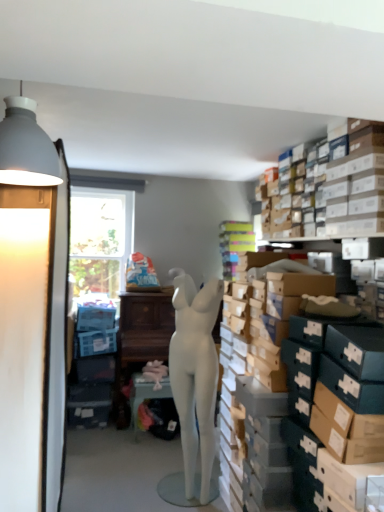
Question: Is white matte lampshade at upper left shorter than matte white lampshade at left?

Choices:
 (A) yes
 (B) no

Answer: (A)

Question: Can you confirm if white matte lampshade at upper left is positioned to the left of matte white lampshade at left?

Choices:
 (A) yes
 (B) no

Answer: (B)

Question: Could you tell me if white matte lampshade at upper left is turned towards matte white lampshade at left?

Choices:
 (A) no
 (B) yes

Answer: (B)

Question: Would you say white matte lampshade at upper left is outside matte white lampshade at left?

Choices:
 (A) no
 (B) yes

Answer: (B)

Question: Is the position of white matte lampshade at upper left more distant than that of matte white lampshade at left?

Choices:
 (A) no
 (B) yes

Answer: (A)

Question: Does white matte lampshade at upper left have a larger size compared to matte white lampshade at left?

Choices:
 (A) no
 (B) yes

Answer: (A)

Question: Can you confirm if matte white table at center is smaller than white matte mannequin at center?

Choices:
 (A) yes
 (B) no

Answer: (A)

Question: Does matte white table at center have a lesser height compared to white matte mannequin at center?

Choices:
 (A) yes
 (B) no

Answer: (A)

Question: Is matte white table at center looking in the opposite direction of white matte mannequin at center?

Choices:
 (A) no
 (B) yes

Answer: (B)

Question: Is matte white table at center not inside white matte mannequin at center?

Choices:
 (A) yes
 (B) no

Answer: (A)

Question: Can you confirm if matte white table at center is positioned to the left of white matte mannequin at center?

Choices:
 (A) yes
 (B) no

Answer: (A)

Question: Is the position of matte white table at center more distant than that of white matte mannequin at center?

Choices:
 (A) yes
 (B) no

Answer: (A)

Question: Does white matte mannequin at center have a smaller size compared to matte white lampshade at left?

Choices:
 (A) no
 (B) yes

Answer: (B)